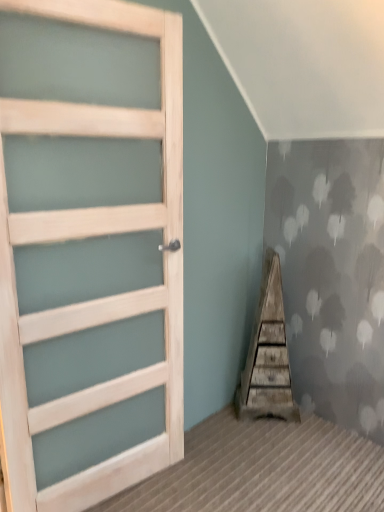
At what (x,y) coordinates should I click in order to perform the action: click on free spot to the right of light wood door at left. Please return your answer as a coordinate pair (x, y). Image resolution: width=384 pixels, height=512 pixels. Looking at the image, I should click on (215, 476).